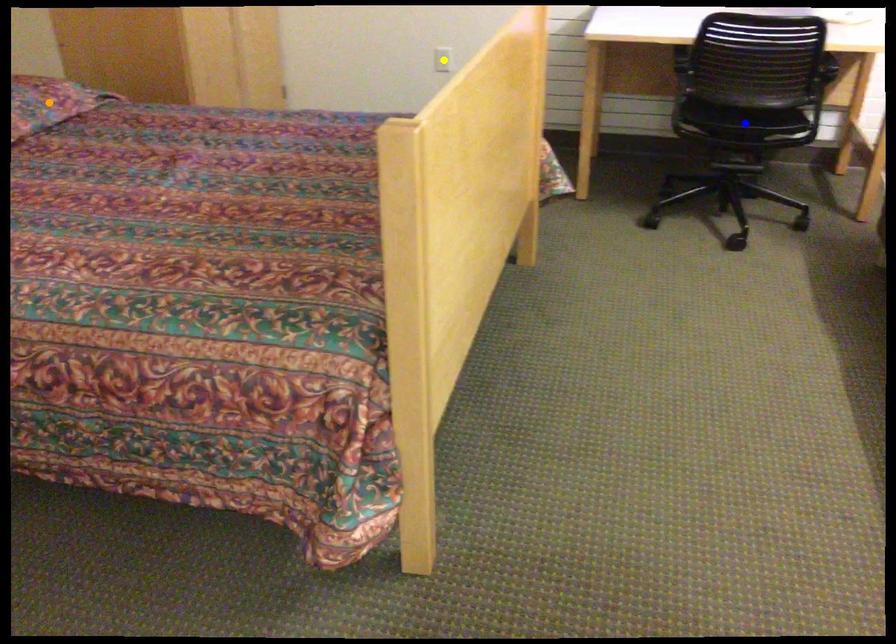
Looking at this image, order these from nearest to farthest:
orange point, blue point, yellow point

yellow point < blue point < orange point